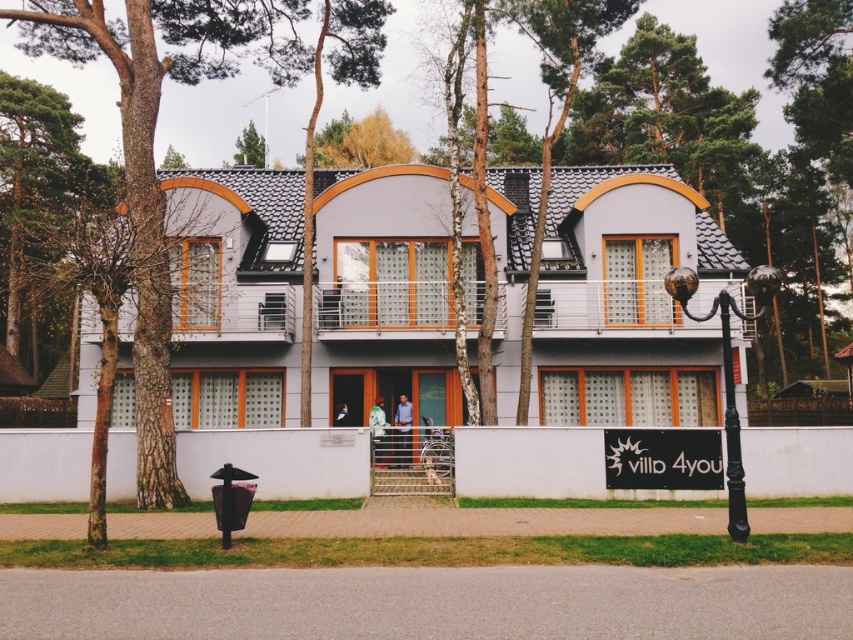
Question: Which object is the closest to the green fabric jacket at center?

Choices:
 (A) blue fabric shirt at center
 (B) blue shirt at center

Answer: (B)

Question: Does blue shirt at center appear on the right side of blue fabric shirt at center?

Choices:
 (A) yes
 (B) no

Answer: (A)

Question: Considering the relative positions of blue shirt at center and green fabric jacket at center in the image provided, where is blue shirt at center located with respect to green fabric jacket at center?

Choices:
 (A) left
 (B) right

Answer: (B)

Question: Which of the following is the farthest from the observer?

Choices:
 (A) (346, 417)
 (B) (403, 413)

Answer: (A)

Question: Which object is farther from the camera taking this photo?

Choices:
 (A) blue fabric shirt at center
 (B) green fabric jacket at center

Answer: (A)

Question: Can you confirm if blue shirt at center is wider than green fabric jacket at center?

Choices:
 (A) no
 (B) yes

Answer: (B)